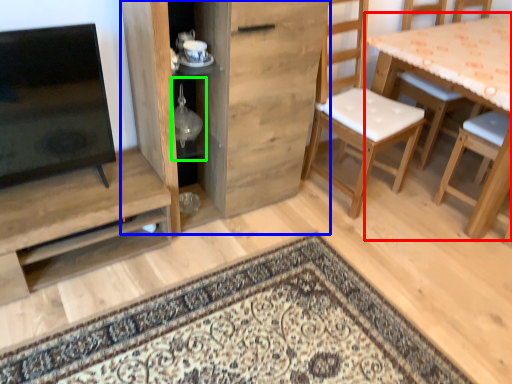
Question: Considering the real-world distances, which object is farthest from table (highlighted by a red box)? cabinetry (highlighted by a blue box) or shelf (highlighted by a green box)?

Choices:
 (A) cabinetry
 (B) shelf

Answer: (B)